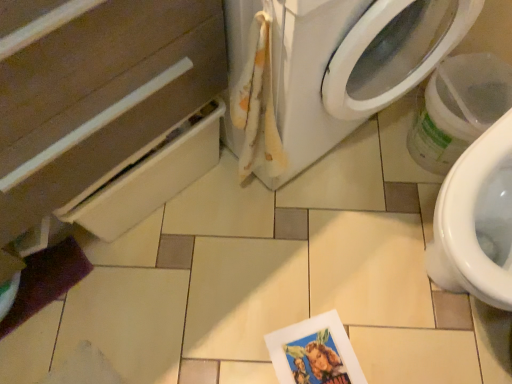
Where is `white fabric washing machine at center`? Image resolution: width=512 pixels, height=384 pixels. white fabric washing machine at center is located at coordinates (342, 62).

Image resolution: width=512 pixels, height=384 pixels. In order to click on white fabric washing machine at center in this screenshot , I will do `click(342, 62)`.

Who is bigger, printed paper postcard at lower center or matte white drawer at lower left?

Bigger between the two is matte white drawer at lower left.

Is printed paper postcard at lower center thinner than matte white drawer at lower left?

Correct, the width of printed paper postcard at lower center is less than that of matte white drawer at lower left.

From their relative heights in the image, would you say printed paper postcard at lower center is taller or shorter than matte white drawer at lower left?

Considering their sizes, printed paper postcard at lower center has less height than matte white drawer at lower left.

Looking at this image, is matte white drawer at lower left wider than printed paper postcard at lower center?

Yes.

Is matte white drawer at lower left far away from printed paper postcard at lower center?

No, there isn't a large distance between matte white drawer at lower left and printed paper postcard at lower center.

From the picture: Between matte white drawer at lower left and printed paper postcard at lower center, which one has smaller size?

printed paper postcard at lower center is smaller.

Does point (169, 46) come in front of point (296, 329)?

Yes.

From the image's perspective, is fluffy white towel at upper center above printed paper postcard at lower center?

Yes, from the image's perspective, fluffy white towel at upper center is above printed paper postcard at lower center.

Considering the relative sizes of fluffy white towel at upper center and printed paper postcard at lower center in the image provided, is fluffy white towel at upper center thinner than printed paper postcard at lower center?

Yes.

Could printed paper postcard at lower center be considered to be inside fluffy white towel at upper center?

No, printed paper postcard at lower center is not a part of fluffy white towel at upper center.

Looking at this image, could you tell me if fluffy white towel at upper center is facing printed paper postcard at lower center?

No.

This screenshot has width=512, height=384. Identify the location of laundry behind the white fabric washing machine at center. (x=258, y=105).

Between white fabric washing machine at center and fluffy white towel at upper center, which one has more height?

Standing taller between the two is white fabric washing machine at center.

Considering the positions of objects white fabric washing machine at center and fluffy white towel at upper center in the image provided, who is more to the right, white fabric washing machine at center or fluffy white towel at upper center?

white fabric washing machine at center is more to the right.

Relative to printed paper postcard at lower center, is white fabric washing machine at center in front or behind?

In the image, white fabric washing machine at center appears in front of printed paper postcard at lower center.

Could printed paper postcard at lower center be considered to be inside white fabric washing machine at center?

Definitely not — printed paper postcard at lower center is not inside white fabric washing machine at center.

At what (x,y) coordinates should I click in order to perform the action: click on postcard located on the right of white fabric washing machine at center. Please return your answer as a coordinate pair (x, y). This screenshot has width=512, height=384. Looking at the image, I should click on (314, 352).

From the image's perspective, which is above, white fabric washing machine at center or printed paper postcard at lower center?

white fabric washing machine at center, from the image's perspective.

Considering the sizes of objects printed paper postcard at lower center and white fabric washing machine at center in the image provided, who is shorter, printed paper postcard at lower center or white fabric washing machine at center?

printed paper postcard at lower center is shorter.

From the image's perspective, between printed paper postcard at lower center and white fabric washing machine at center, who is located below?

printed paper postcard at lower center appears lower in the image.

Is printed paper postcard at lower center not close to white fabric washing machine at center?

printed paper postcard at lower center is actually quite close to white fabric washing machine at center.

Would you say printed paper postcard at lower center contains white fabric washing machine at center?

No.

Considering the relative sizes of printed paper postcard at lower center and fluffy white towel at upper center in the image provided, is printed paper postcard at lower center bigger than fluffy white towel at upper center?

Incorrect, printed paper postcard at lower center is not larger than fluffy white towel at upper center.

Is point (340, 338) farther from viewer compared to point (244, 100)?

Yes, it is behind point (244, 100).

Consider the image. Between printed paper postcard at lower center and fluffy white towel at upper center, which one has smaller width?

fluffy white towel at upper center is thinner.

Locate an element on the screen. This screenshot has width=512, height=384. postcard below the matte white drawer at lower left (from a real-world perspective) is located at coordinates (314, 352).

Locate an element on the screen. The image size is (512, 384). drawer above the printed paper postcard at lower center (from the image's perspective) is located at coordinates (100, 91).

From the image, which object appears to be farther from fluffy white towel at upper center, matte white drawer at lower left or white fabric washing machine at center?

matte white drawer at lower left lies further to fluffy white towel at upper center than the other object.

When comparing their distances from printed paper postcard at lower center, does fluffy white towel at upper center or matte white drawer at lower left seem further?

The object further to printed paper postcard at lower center is matte white drawer at lower left.

Based on their spatial positions, is white fabric washing machine at center or matte white drawer at lower left closer to fluffy white towel at upper center?

white fabric washing machine at center is closer to fluffy white towel at upper center.

Looking at the image, which one is located closer to white fabric washing machine at center, printed paper postcard at lower center or fluffy white towel at upper center?

fluffy white towel at upper center lies closer to white fabric washing machine at center than the other object.

When comparing their distances from fluffy white towel at upper center, does white fabric washing machine at center or printed paper postcard at lower center seem closer?

Among the two, white fabric washing machine at center is located nearer to fluffy white towel at upper center.

Looking at the image, which one is located closer to white fabric washing machine at center, fluffy white towel at upper center or printed paper postcard at lower center?

fluffy white towel at upper center is positioned closer to the anchor white fabric washing machine at center.

Which object lies further to the anchor point matte white drawer at lower left, fluffy white towel at upper center or white fabric washing machine at center?

white fabric washing machine at center is positioned further to the anchor matte white drawer at lower left.

Based on their spatial positions, is printed paper postcard at lower center or white fabric washing machine at center further from fluffy white towel at upper center?

printed paper postcard at lower center.

Locate an element on the screen. laundry between matte white drawer at lower left and white fabric washing machine at center in the horizontal direction is located at coordinates (258, 105).

I want to click on laundry between white fabric washing machine at center and printed paper postcard at lower center vertically, so click(258, 105).

Find the location of a particular element. This screenshot has width=512, height=384. laundry located between matte white drawer at lower left and printed paper postcard at lower center in the left-right direction is located at coordinates (258, 105).

Locate an element on the screen. drawer between white fabric washing machine at center and printed paper postcard at lower center from top to bottom is located at coordinates (100, 91).